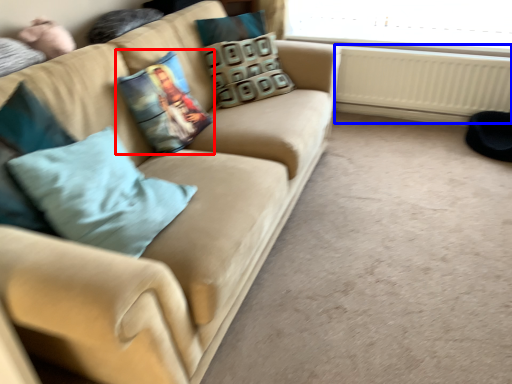
Question: Which object appears closest to the camera in this image, pillow (highlighted by a red box) or radiator (highlighted by a blue box)?

Choices:
 (A) pillow
 (B) radiator

Answer: (A)